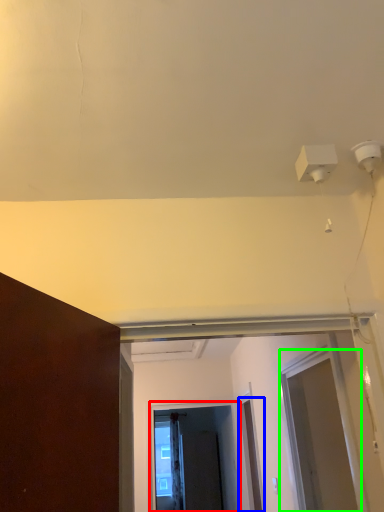
Question: Considering the real-world distances, which object is closest to screen door (highlighted by a red box)? door (highlighted by a blue box) or screen door (highlighted by a green box).

Choices:
 (A) door
 (B) screen door

Answer: (A)